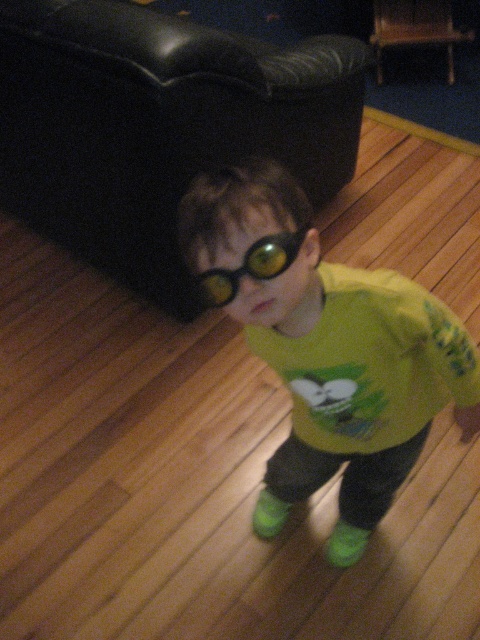
Question: Does green matte shirt at center have a larger size compared to green matte/glossy goggles at center?

Choices:
 (A) no
 (B) yes

Answer: (B)

Question: Does green matte shirt at center appear under green matte/glossy goggles at center?

Choices:
 (A) no
 (B) yes

Answer: (B)

Question: Which point is farther to the camera?

Choices:
 (A) green matte shirt at center
 (B) green matte/glossy goggles at center

Answer: (A)

Question: Among these objects, which one is nearest to the camera?

Choices:
 (A) green matte shirt at center
 (B) green matte/glossy goggles at center

Answer: (B)

Question: Can you confirm if green matte shirt at center is bigger than green matte/glossy goggles at center?

Choices:
 (A) no
 (B) yes

Answer: (B)